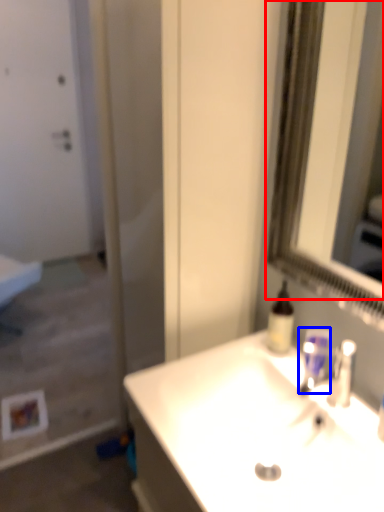
Question: Which point is closer to the camera, mirror (highlighted by a red box) or mouthwash (highlighted by a blue box)?

Choices:
 (A) mirror
 (B) mouthwash

Answer: (A)